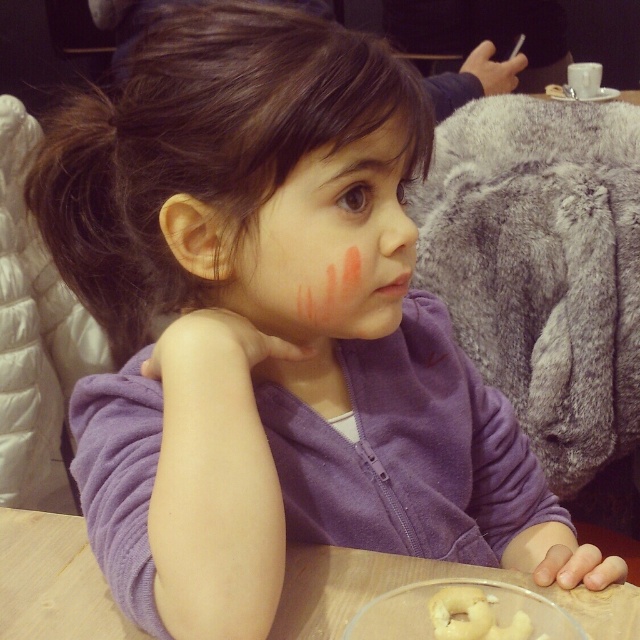
Question: Is wooden table at lower center wider than matte brown hair at upper center?

Choices:
 (A) yes
 (B) no

Answer: (A)

Question: Does fuzzy gray stuffed animal at right have a lesser width compared to matte pink blush at center?

Choices:
 (A) yes
 (B) no

Answer: (B)

Question: Estimate the real-world distances between objects in this image. Which object is closer to the matte brown hair at upper center?

Choices:
 (A) matte pink blush at center
 (B) white doughnut at lower center
 (C) fuzzy gray stuffed animal at right

Answer: (A)

Question: Which of the following is the farthest from the observer?

Choices:
 (A) matte pink blush at center
 (B) fuzzy gray stuffed animal at right

Answer: (B)

Question: Which point is closer to the camera?

Choices:
 (A) (68, 602)
 (B) (497, 632)
 (C) (369, 124)

Answer: (B)

Question: Is matte pink blush at center to the left of white doughnut at lower center from the viewer's perspective?

Choices:
 (A) no
 (B) yes

Answer: (B)